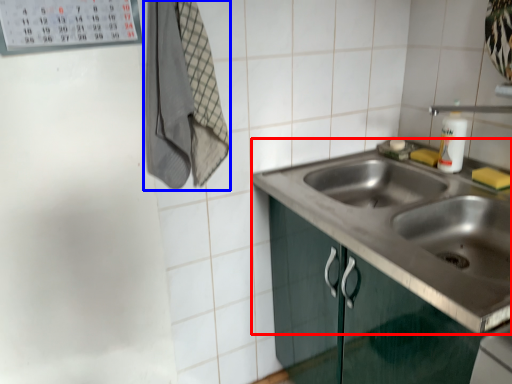
Question: Which object appears farthest to the camera in this image, sink (highlighted by a red box) or laundry (highlighted by a blue box)?

Choices:
 (A) sink
 (B) laundry

Answer: (B)